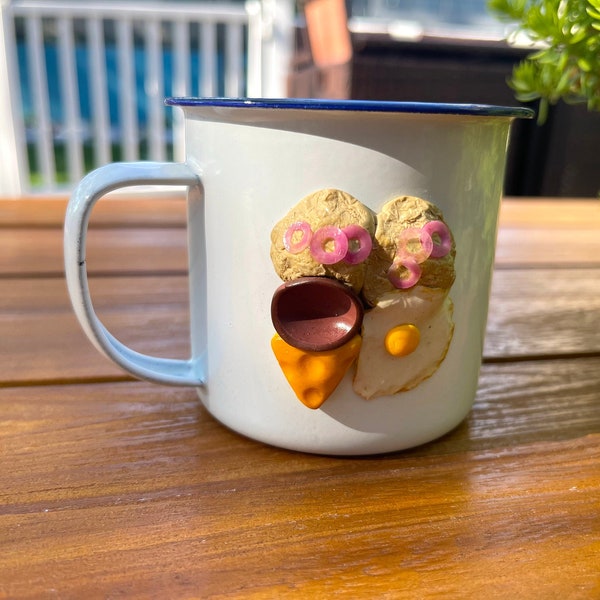
This screenshot has height=600, width=600. I want to click on looks like where paint is chipped on mug handle, so click(x=81, y=265).